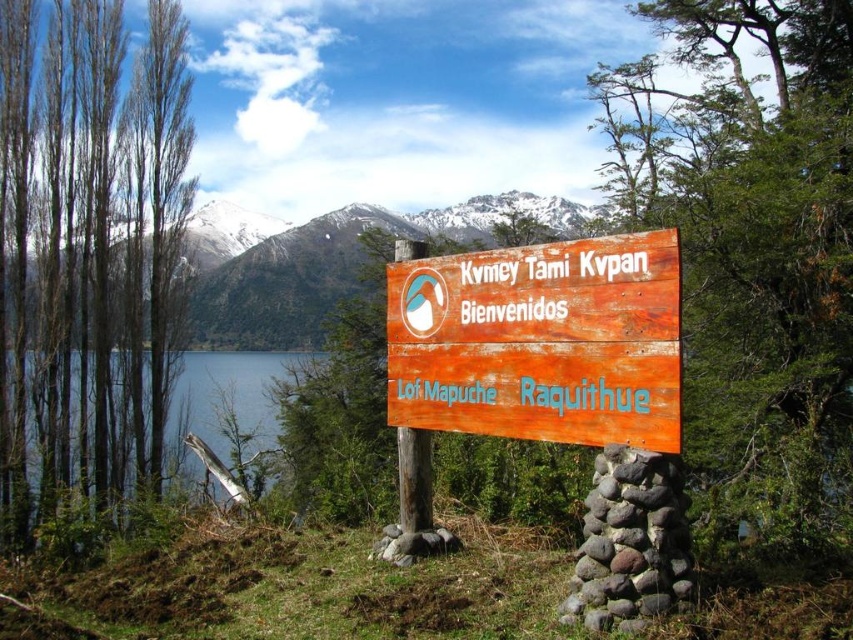
Who is positioned more to the left, brown rock at center or blue water at left?

blue water at left is more to the left.

You are a GUI agent. You are given a task and a screenshot of the screen. Output one action in this format:
    pyautogui.click(x=<x>, y=<y>)
    Task: Click on the brown rock at center
    Image resolution: width=853 pixels, height=640 pixels.
    Given the screenshot: What is the action you would take?
    pyautogui.click(x=630, y=541)

Is wooden sign at center above blue water at left?

Correct, wooden sign at center is located above blue water at left.

Does point (543, 362) come behind point (198, 355)?

No, it is in front of (198, 355).

The height and width of the screenshot is (640, 853). I want to click on wooden sign at center, so click(x=540, y=340).

At what (x,y) coordinates should I click in order to perform the action: click on wooden sign at center. Please return your answer as a coordinate pair (x, y). The height and width of the screenshot is (640, 853). Looking at the image, I should click on (540, 340).

Which is more to the right, wooden sign at center or brown rock at center?

brown rock at center

Which is in front, point (676, 252) or point (648, 541)?

Point (676, 252)

Does point (412, 330) lie in front of point (596, 515)?

No, (412, 330) is behind (596, 515).

The width and height of the screenshot is (853, 640). In order to click on wooden sign at center in this screenshot , I will do click(x=540, y=340).